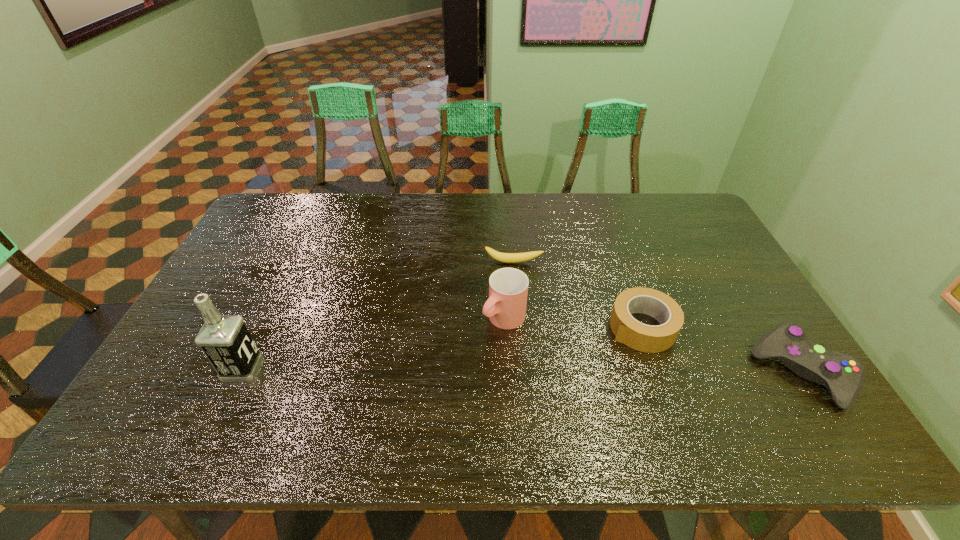
At what (x,y) coordinates should I click in order to perform the action: click on vacant region located at the edge of the duct tape. Please return your answer as a coordinate pair (x, y). This screenshot has height=540, width=960. Looking at the image, I should click on (547, 387).

Locate an element on the screen. free region located at the edge of the duct tape is located at coordinates (560, 379).

This screenshot has width=960, height=540. Identify the location of free space located on the upward curve of the farthest object. (511, 323).

Locate an element on the screen. This screenshot has width=960, height=540. free spot located on the upward curve of the farthest object is located at coordinates (512, 279).

You are a GUI agent. You are given a task and a screenshot of the screen. Output one action in this format:
    pyautogui.click(x=<x>, y=<y>)
    Task: Click on the vacant position located on the upward curve of the farthest object
    This screenshot has height=540, width=960.
    Given the screenshot: What is the action you would take?
    [x=511, y=362]

Image resolution: width=960 pixels, height=540 pixels. I want to click on vacant space located on the side of the cup with the handle, so click(428, 388).

This screenshot has height=540, width=960. What are the coordinates of `free space located 0.160m on the side of the cup with the handle` in the screenshot? It's located at (448, 370).

The image size is (960, 540). Find the location of `free space located on the side of the cup with the handle`. free space located on the side of the cup with the handle is located at coordinates (443, 375).

I want to click on vodka located at the near edge, so click(x=225, y=340).

Image resolution: width=960 pixels, height=540 pixels. What are the coordinates of `control that is at the near edge` in the screenshot? It's located at (843, 374).